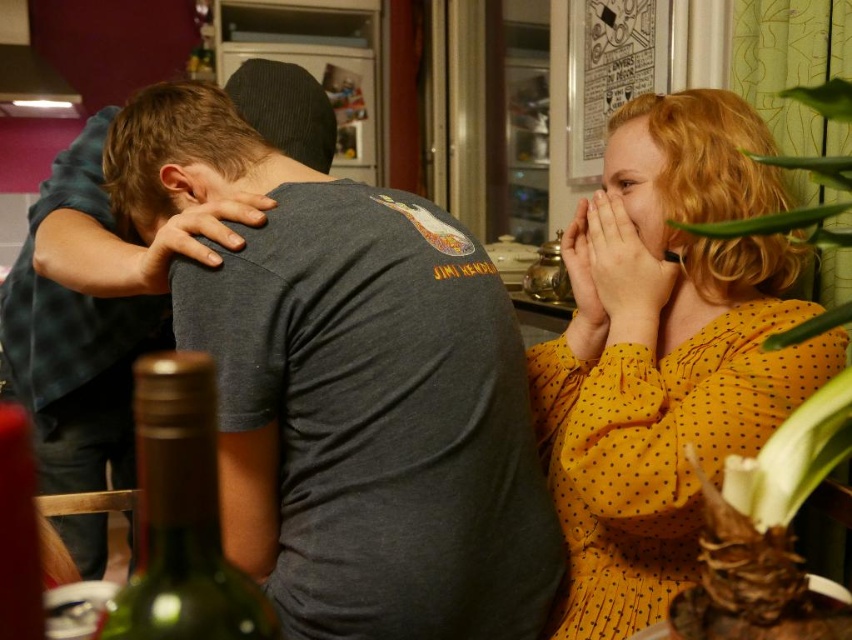
Question: Among these objects, which one is farthest from the camera?

Choices:
 (A) dark gray t-shirt at center
 (B) yellow dotted blouse at right

Answer: (B)

Question: Is dark gray t-shirt at center closer to camera compared to yellow dotted blouse at right?

Choices:
 (A) no
 (B) yes

Answer: (B)

Question: Based on their relative distances, which object is farther from the green glass bottle at lower left?

Choices:
 (A) dark gray t-shirt at center
 (B) yellow dotted blouse at right
 (C) dark gray t-shirt at left

Answer: (C)

Question: Which object is the farthest from the dark gray t-shirt at left?

Choices:
 (A) dark gray t-shirt at center
 (B) green glass bottle at lower left

Answer: (B)

Question: Considering the relative positions of yellow dotted blouse at right and green glass bottle at lower left in the image provided, where is yellow dotted blouse at right located with respect to green glass bottle at lower left?

Choices:
 (A) right
 (B) left

Answer: (A)

Question: Where is yellow dotted blouse at right located in relation to green glass bottle at lower left in the image?

Choices:
 (A) above
 (B) below

Answer: (A)